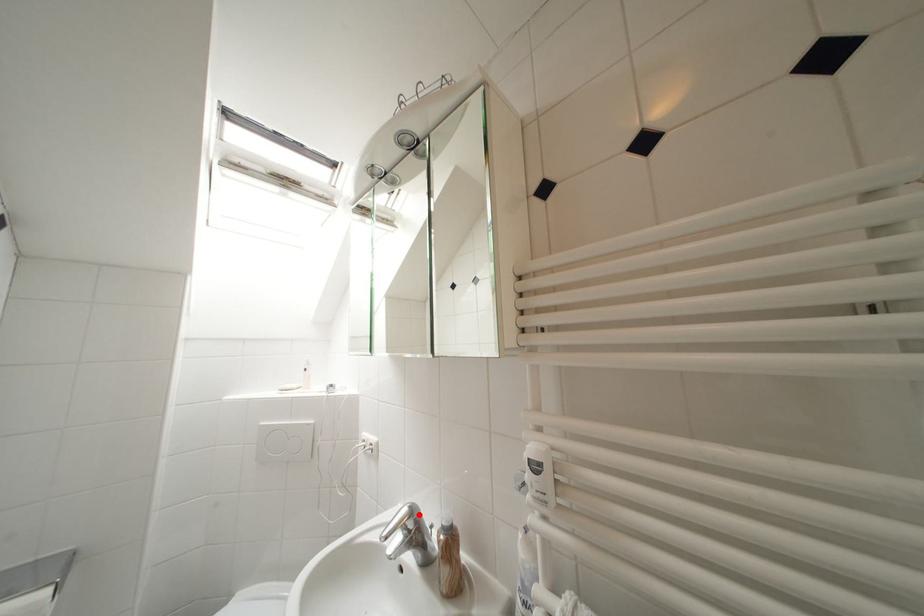
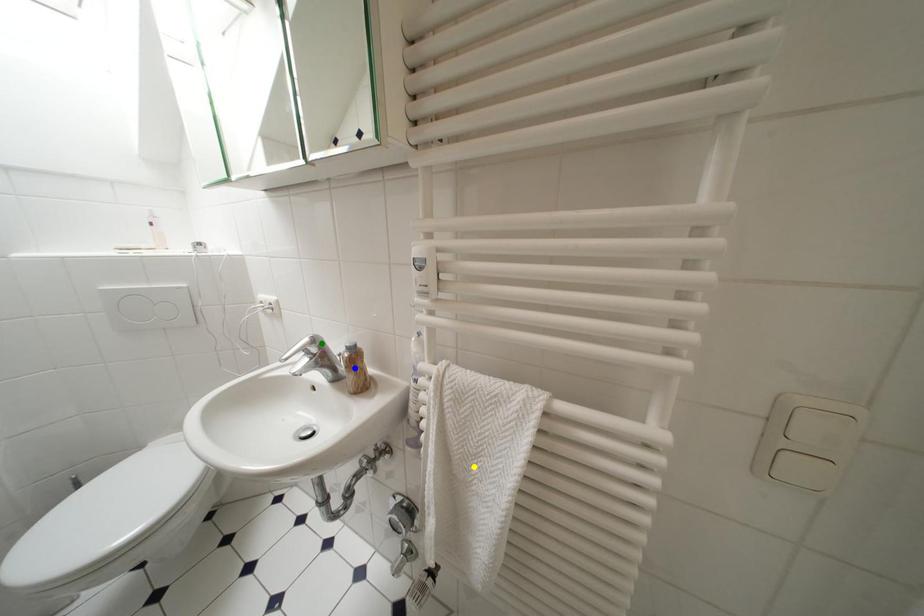
Question: I am providing you with two images of the same scene from different viewpoints. A red point is marked on the first image. You are given multiple points on the second image. Which spot in image 2 lines up with the point in image 1?

Choices:
 (A) blue point
 (B) green point
 (C) yellow point

Answer: (B)